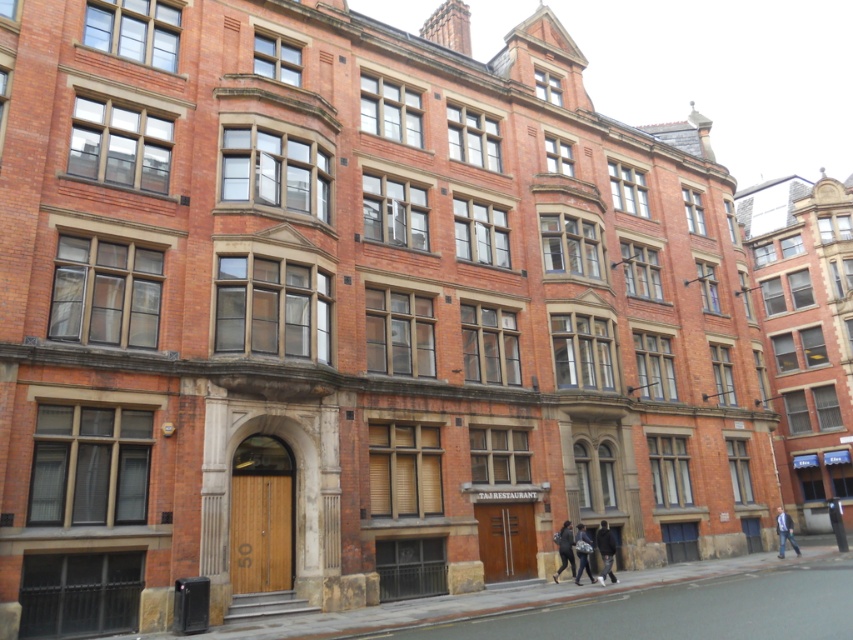
Between dark gray fabric jacket at lower right and dark gray fabric jacket at center, which one is positioned lower?

dark gray fabric jacket at lower right is below.

Is dark gray fabric jacket at lower right bigger than dark gray fabric jacket at center?

Yes.

Where is `dark gray fabric jacket at lower right`? dark gray fabric jacket at lower right is located at coordinates (605, 550).

Which is in front, point (554, 540) or point (581, 525)?

Point (581, 525)

Does dark gray fabric jacket at center have a smaller size compared to dark gray fabric jacket at lower center?

Yes, dark gray fabric jacket at center is smaller than dark gray fabric jacket at lower center.

Who is more forward, (573, 563) or (585, 572)?

Positioned in front is point (585, 572).

You are a GUI agent. You are given a task and a screenshot of the screen. Output one action in this format:
    pyautogui.click(x=<x>, y=<y>)
    Task: Click on the dark gray fabric jacket at center
    The image size is (853, 640).
    Given the screenshot: What is the action you would take?
    pyautogui.click(x=564, y=548)

Between blue denim jacket at lower right and dark gray fabric jacket at lower center, which one has less height?

Standing shorter between the two is dark gray fabric jacket at lower center.

Can you confirm if blue denim jacket at lower right is positioned below dark gray fabric jacket at lower center?

Indeed, blue denim jacket at lower right is positioned under dark gray fabric jacket at lower center.

In order to click on blue denim jacket at lower right in this screenshot , I will do `click(784, 532)`.

What are the coordinates of `blue denim jacket at lower right` in the screenshot? It's located at (784, 532).